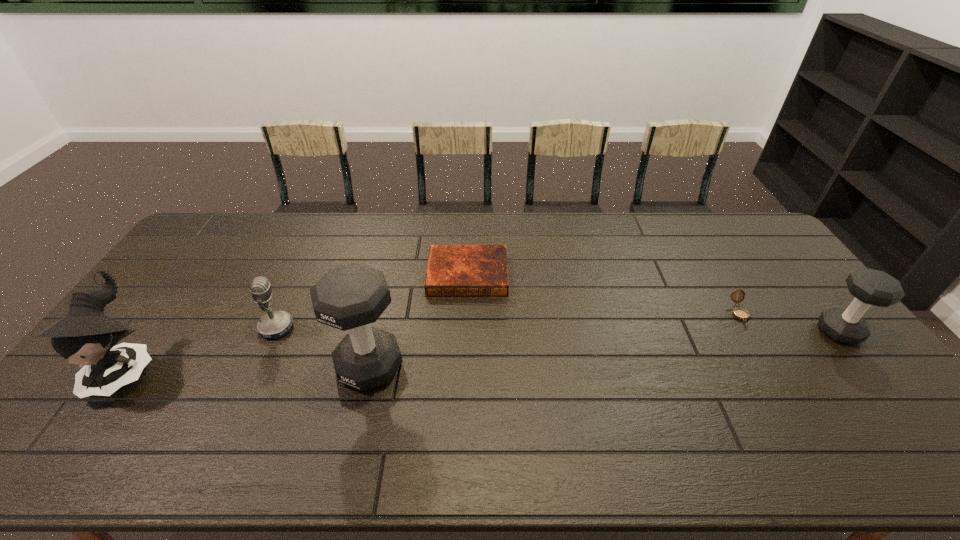
If we want them evenly spaced by inserting an extra dumbbell among them, please locate a free spot for this new dumbbell. Please provide its 2D coordinates. Your answer should be formatted as a tuple, i.e. [(x, y)], where the tuple contains the x and y coordinates of a point satisfying the conditions above.

[(613, 348)]